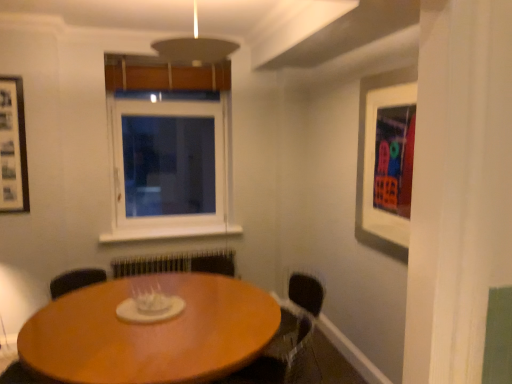
Locate an element on the screen. This screenshot has height=384, width=512. vacant area on top of wooden table at center (from a real-world perspective) is located at coordinates (146, 312).